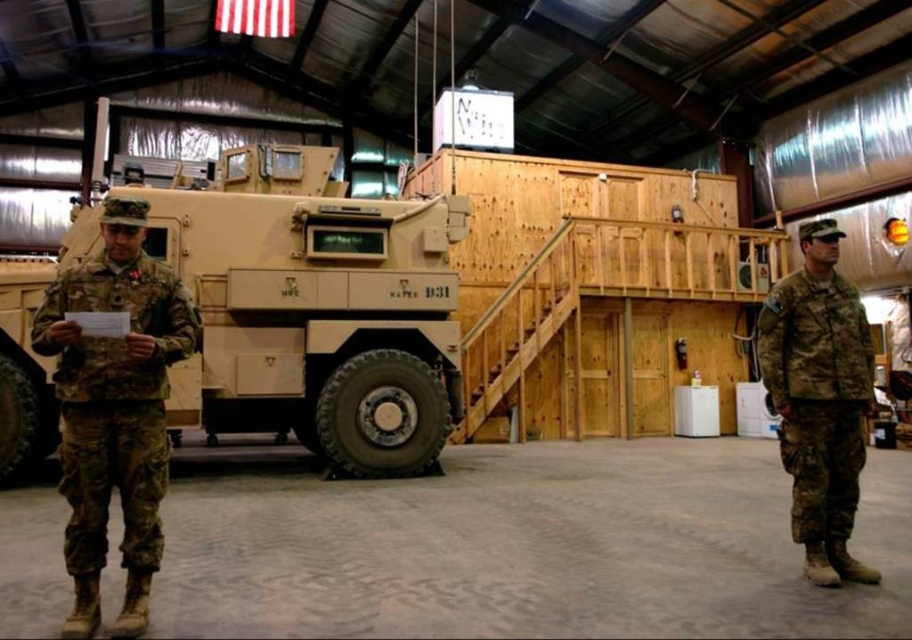
Question: Is camouflage fabric uniform at left bigger than camouflage fabric uniform at right?

Choices:
 (A) yes
 (B) no

Answer: (A)

Question: Is camouflage fabric uniform at left above camouflage fabric uniform at right?

Choices:
 (A) yes
 (B) no

Answer: (A)

Question: Which of the following is the closest to the observer?

Choices:
 (A) camouflage fabric uniform at right
 (B) camouflage fabric uniform at left

Answer: (B)

Question: Is the position of camouflage fabric uniform at left more distant than that of camouflage fabric uniform at right?

Choices:
 (A) yes
 (B) no

Answer: (B)